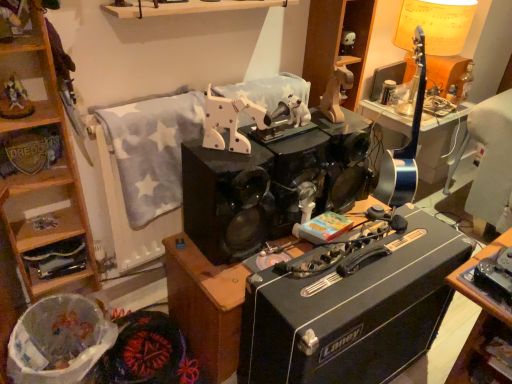
Question: In the image, is wooden horse at upper left, marked as the second toy in a bottom-to-top arrangement, positioned in front of or behind black glossy stereo at center?

Choices:
 (A) behind
 (B) front

Answer: (A)

Question: Which is correct: wooden horse at upper left, which is the first toy from left to right, is inside black glossy stereo at center, or outside of it?

Choices:
 (A) inside
 (B) outside

Answer: (B)

Question: Estimate the real-world distances between objects in this image. Which object is farther from the black plastic amplifier at center?

Choices:
 (A) wooden cabinet at lower left, arranged as the second cabinetry when viewed from the back
 (B) wooden shelf at upper center, acting as the 2th cabinetry starting from the front
 (C) wooden horse at upper left, which ranks as the first toy in front-to-back order
 (D) wooden horse at upper center, which is the 3th toy from left to right
 (E) metallic silver badge at left, the third shelf from the right

Answer: (C)

Question: Based on their relative distances, which object is farther from the black plastic amplifier at center?

Choices:
 (A) wooden horse at upper left, placed as the fourth toy when sorted from back to front
 (B) white matte skull at upper center, which is the 4th toy in front-to-back order
 (C) wooden shelf at upper center, the 2th cabinetry positioned from the bottom
 (D) matte yellow lampshade at upper right
 (E) wooden toy horse at upper left

Answer: (B)